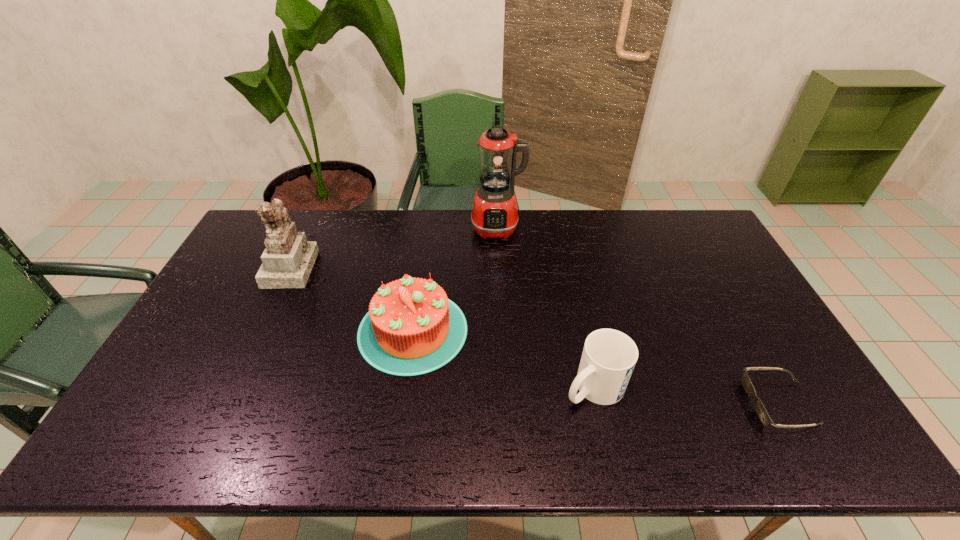
This screenshot has width=960, height=540. Find the location of `object that is at the left edge`. object that is at the left edge is located at coordinates (287, 261).

The width and height of the screenshot is (960, 540). In order to click on object that is at the right edge in this screenshot , I will do `click(761, 411)`.

At what (x,y) coordinates should I click in order to perform the action: click on object situated at the far left corner. Please return your answer as a coordinate pair (x, y). Looking at the image, I should click on (287, 261).

Identify the location of object that is positioned at the near right corner. Image resolution: width=960 pixels, height=540 pixels. (761, 411).

You are a GUI agent. You are given a task and a screenshot of the screen. Output one action in this format:
    pyautogui.click(x=<x>, y=<y>)
    Task: Click on the free location at the far edge
    
    Given the screenshot: What is the action you would take?
    pyautogui.click(x=476, y=244)

The width and height of the screenshot is (960, 540). What are the coordinates of `free point at the left edge` in the screenshot? It's located at (207, 327).

Find the location of a particular element. The image size is (960, 540). blank space at the right edge is located at coordinates (693, 272).

In the image, there is a desktop. Where is `vacant region at the far right corner`? vacant region at the far right corner is located at coordinates (672, 228).

I want to click on vacant point located between the third object from right to left and the fourth object from left to right, so click(x=545, y=308).

You are a GUI agent. You are given a task and a screenshot of the screen. Output one action in this format:
    pyautogui.click(x=<x>, y=<y>)
    Task: Click on the free point between the figurine and the cake
    
    Given the screenshot: What is the action you would take?
    pyautogui.click(x=351, y=299)